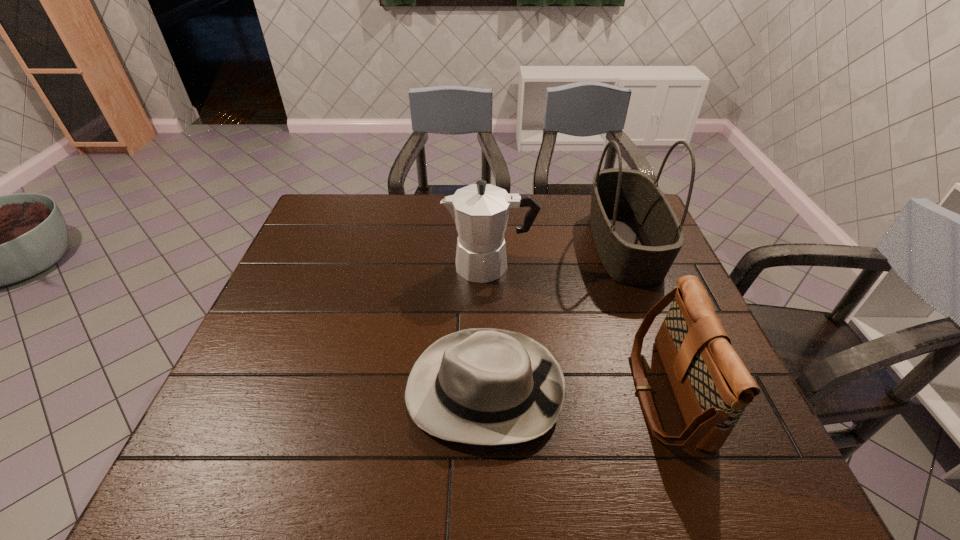
Find the location of `the tallest object`. the tallest object is located at coordinates (637, 235).

Where is `coffeepot`? Image resolution: width=960 pixels, height=540 pixels. coffeepot is located at coordinates (481, 210).

This screenshot has width=960, height=540. Identify the location of shoulder bag. (712, 386).

Image resolution: width=960 pixels, height=540 pixels. I want to click on fedora, so tap(481, 386).

Locate an element on the screen. free space located 0.050m on the left of the tallest object is located at coordinates (575, 244).

Locate an element on the screen. vacant area situated 0.390m at the spout of the third shortest object is located at coordinates (311, 266).

At what (x,y) coordinates should I click in order to perform the action: click on vacant space situated at the spout of the third shortest object. Please return your answer as a coordinate pair (x, y). Image resolution: width=960 pixels, height=540 pixels. Looking at the image, I should click on pos(366,266).

I want to click on vacant space located 0.310m at the spout of the third shortest object, so click(339, 266).

You are a GUI agent. You are given a task and a screenshot of the screen. Output one action in this format:
    pyautogui.click(x=<x>, y=<y>)
    Task: Click on the free space located on the front-facing side of the shoulder bag
    Image resolution: width=960 pixels, height=540 pixels.
    Given the screenshot: What is the action you would take?
    click(x=459, y=393)

Locate an element on the screen. Image resolution: width=960 pixels, height=540 pixels. free space located 0.310m on the front-facing side of the shoulder bag is located at coordinates (495, 393).